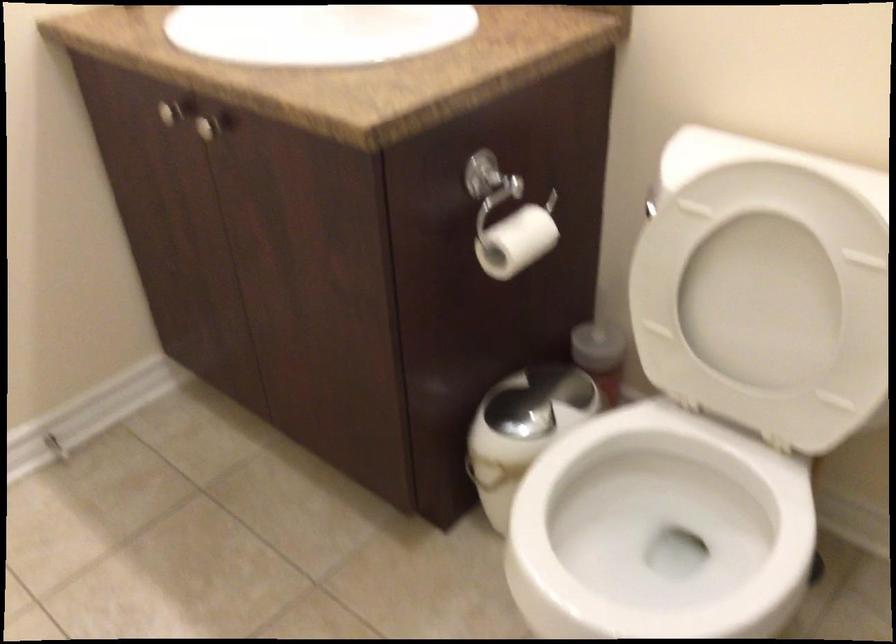
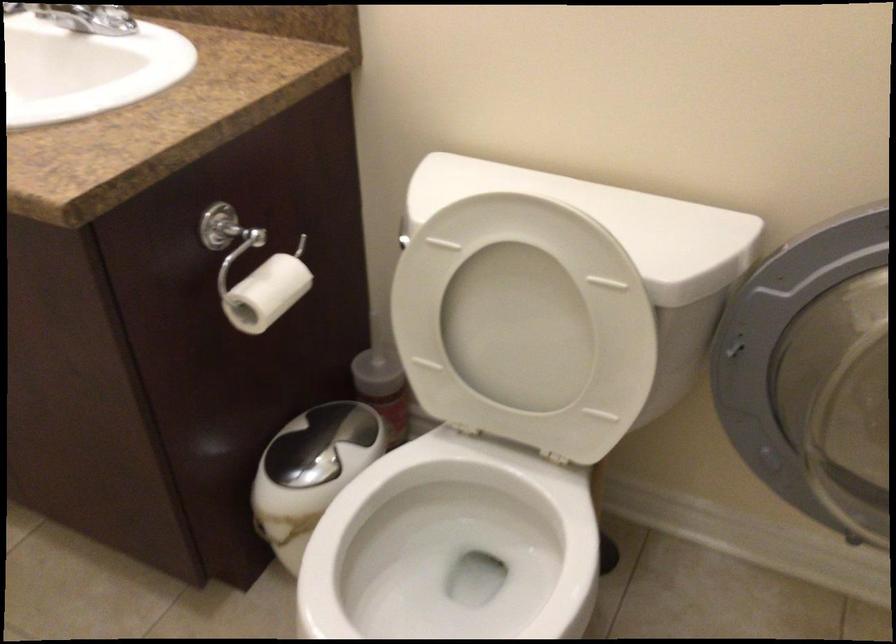
In the second image, find the point that corresponds to point 512,232 in the first image.

(263, 286)